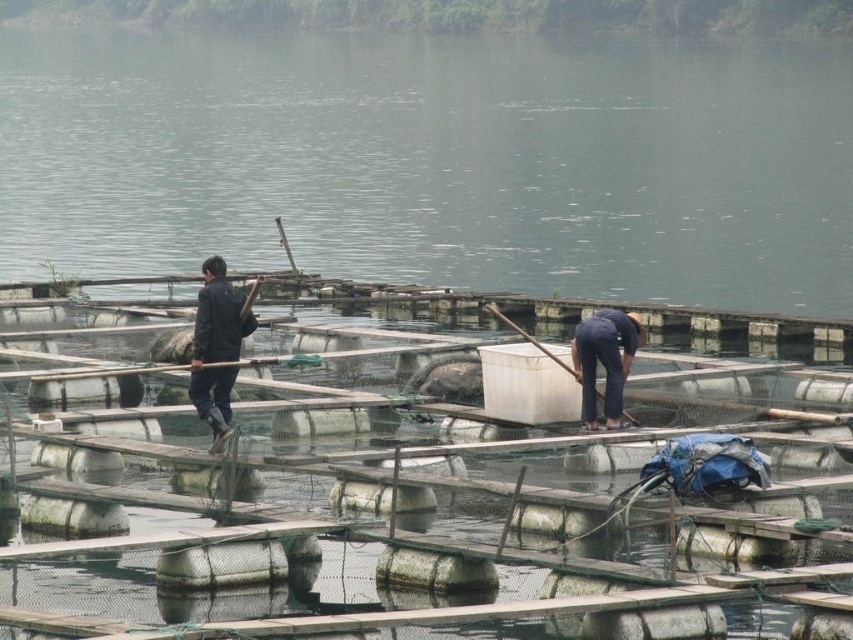
Question: Can you confirm if clear water at center is positioned above dark blue jacket at upper left?

Choices:
 (A) no
 (B) yes

Answer: (B)

Question: Estimate the real-world distances between objects in this image. Which object is closer to the clear water at center?

Choices:
 (A) dark blue uniform at lower center
 (B) dark blue jacket at upper left

Answer: (A)

Question: Which object is the closest to the clear water at center?

Choices:
 (A) dark blue jacket at upper left
 (B) dark blue uniform at lower center

Answer: (B)

Question: Which of these objects is positioned farthest from the dark blue jacket at upper left?

Choices:
 (A) dark blue uniform at lower center
 (B) clear water at center

Answer: (B)

Question: Does clear water at center have a larger size compared to dark blue uniform at lower center?

Choices:
 (A) yes
 (B) no

Answer: (A)

Question: Is clear water at center wider than dark blue jacket at upper left?

Choices:
 (A) yes
 (B) no

Answer: (A)